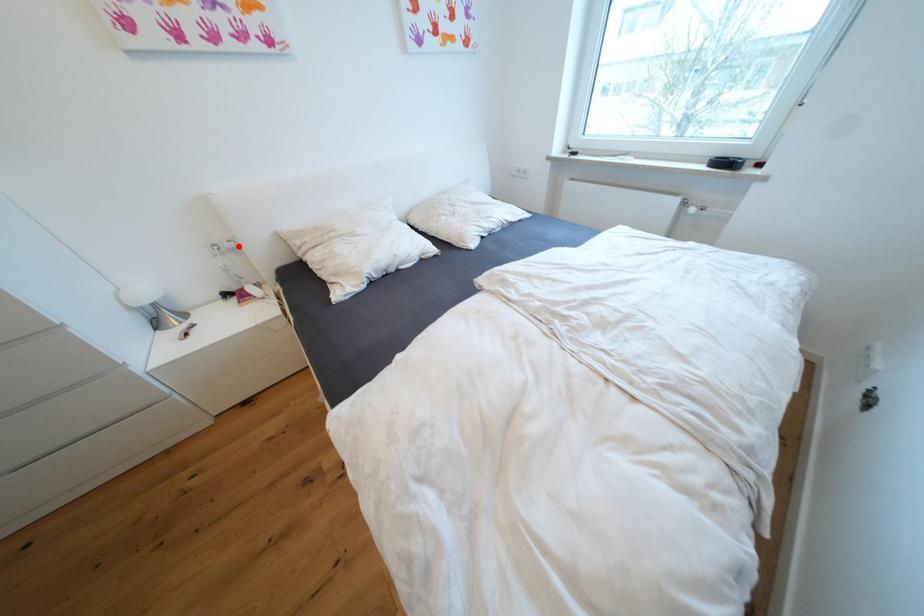
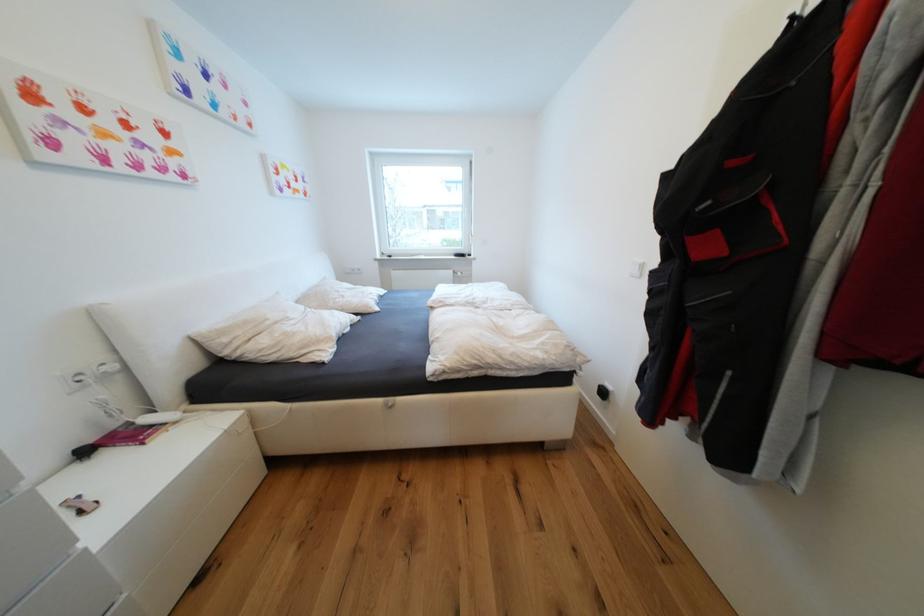
Question: I am providing you with two images of the same scene from different viewpoints. A red point is marked on the first image. Is the red point's position out of view in image 2?

Choices:
 (A) Yes
 (B) No

Answer: (B)